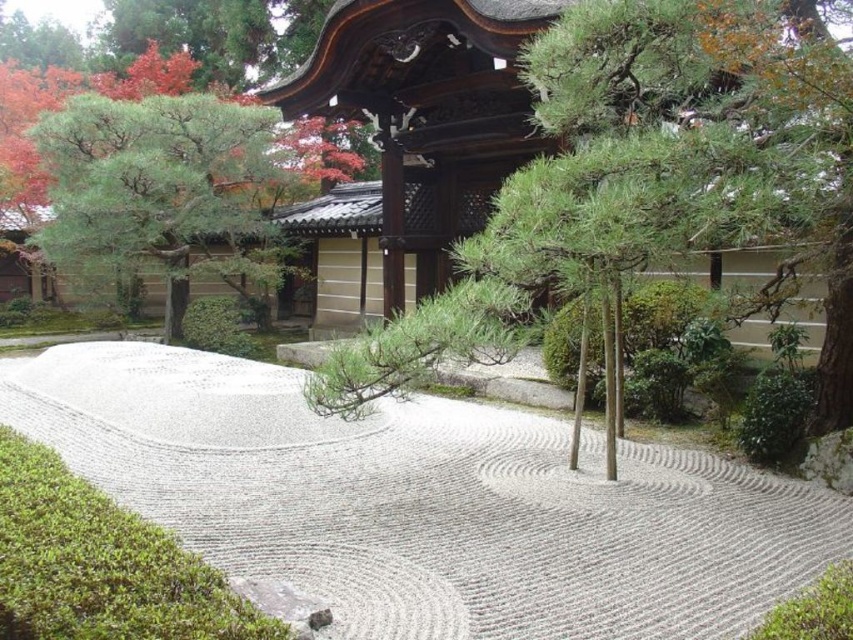
Which is more to the left, white gravel path at center or green textured pine tree at center?

From the viewer's perspective, white gravel path at center appears more on the left side.

Who is lower down, white gravel path at center or green textured pine tree at center?

white gravel path at center is lower down.

Between point (235, 576) and point (732, 172), which one is positioned in front?

Positioned in front is point (235, 576).

Locate an element on the screen. white gravel path at center is located at coordinates (426, 500).